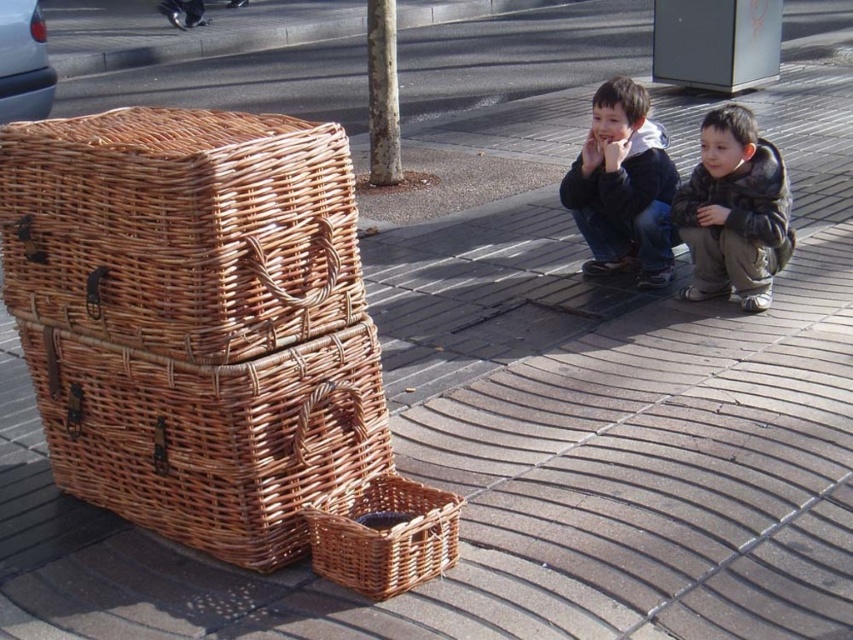
You are a delivery person trying to place a heavy package on the ground. The asphalt at upper center is the only flat surface available. Is the woven brown basket at lower center in the way of placing the package there?

The woven brown basket at lower center is positioned under the asphalt at upper center, so it is blocking the area where the package needs to be placed. Therefore, you should move the basket before placing the package on the asphalt at upper center.

You are a delivery person who needs to place a package between the woven brown basket at left and the woven brown basket at lower center. The package is 12 inches long. Will it fit in the space between them?

The distance between the woven brown basket at left and the woven brown basket at lower center is 10.97 inches. Since the package is 12 inches long, it will not fit in the space between them.

You are a delivery person who needs to choose between the woven brown basket at left and the woven brown basket at lower center to carry a package. Which basket should you choose if you want the larger one?

The woven brown basket at left is bigger than the woven brown basket at lower center, so you should choose the woven brown basket at left.